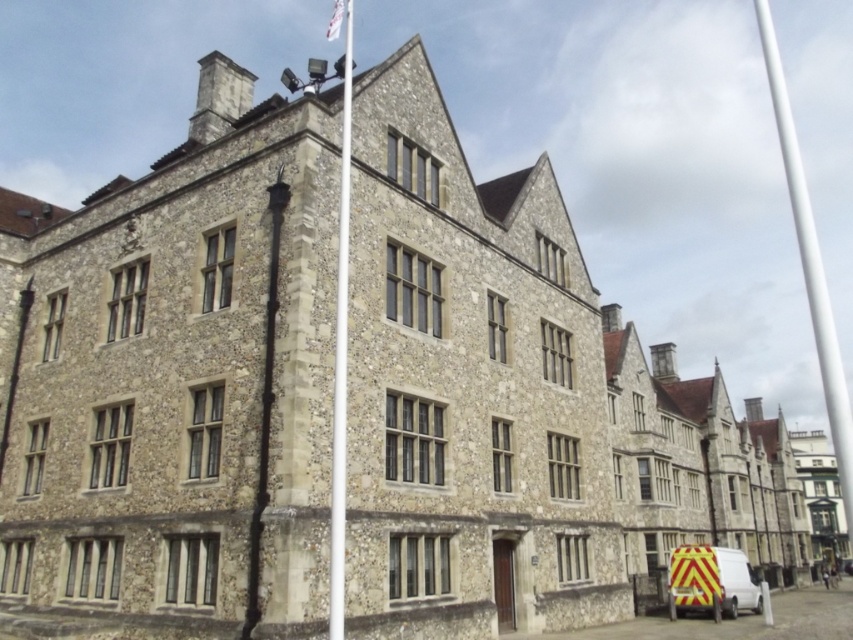
Question: Does white smooth flag pole at upper center lie behind yellow reflective van at lower right?

Choices:
 (A) no
 (B) yes

Answer: (A)

Question: Can you confirm if yellow reflective van at lower right is positioned below white fabric flag at upper center?

Choices:
 (A) no
 (B) yes

Answer: (B)

Question: Among these points, which one is farthest from the camera?

Choices:
 (A) (676, 579)
 (B) (793, 184)
 (C) (331, 570)

Answer: (B)

Question: Which point appears closest to the camera in this image?

Choices:
 (A) (801, 218)
 (B) (328, 36)
 (C) (846, 566)

Answer: (C)

Question: Which object is farther from the camera taking this photo?

Choices:
 (A) white smooth pole at upper right
 (B) white fabric flag at upper center
 (C) white smooth flag pole at upper center

Answer: (B)

Question: Is white smooth pole at upper right to the right of yellow reflective van at center from the viewer's perspective?

Choices:
 (A) yes
 (B) no

Answer: (A)